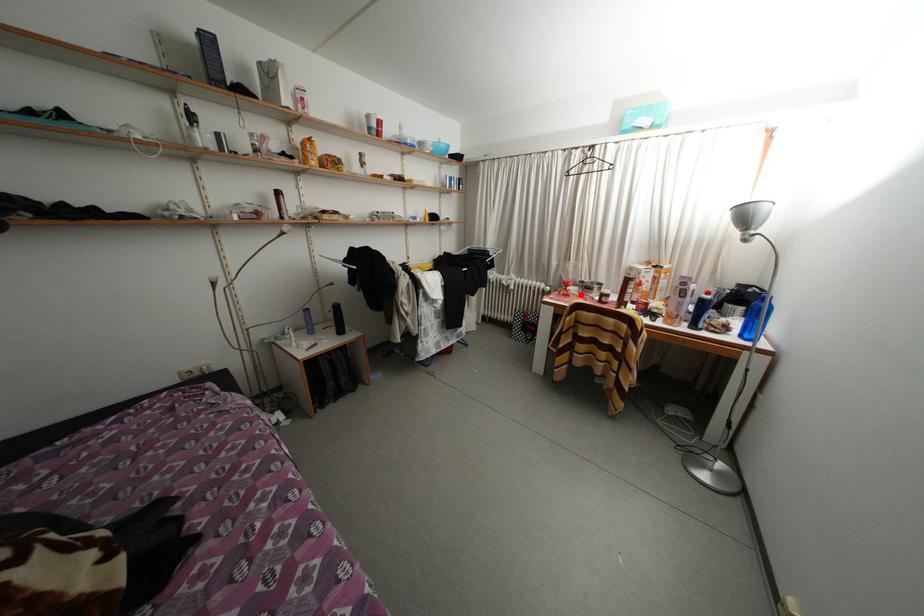
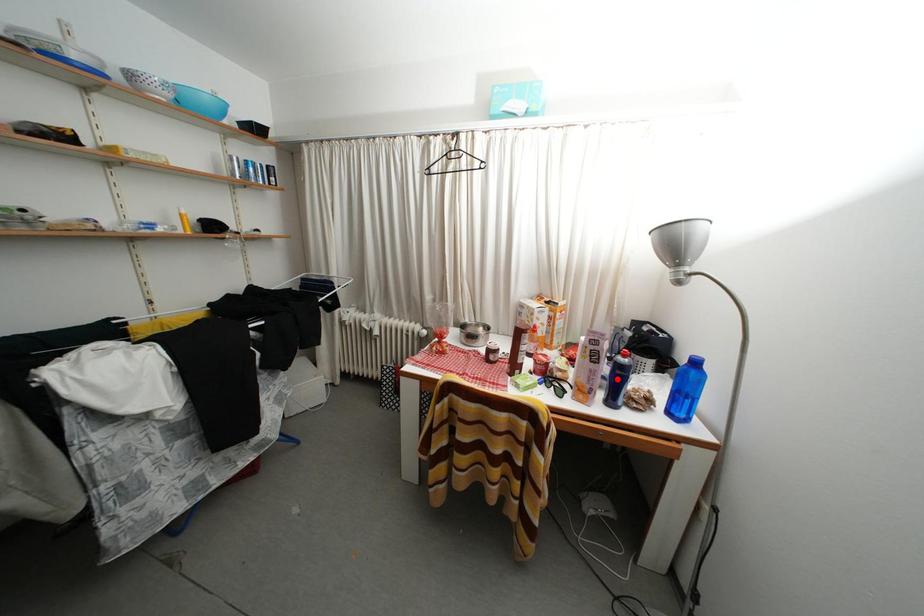
I am providing you with two images of the same scene from different viewpoints. A red point is marked on the first image and another point is marked on the second image. Do the highlighted points in image1 and image2 indicate the same real-world spot?

No